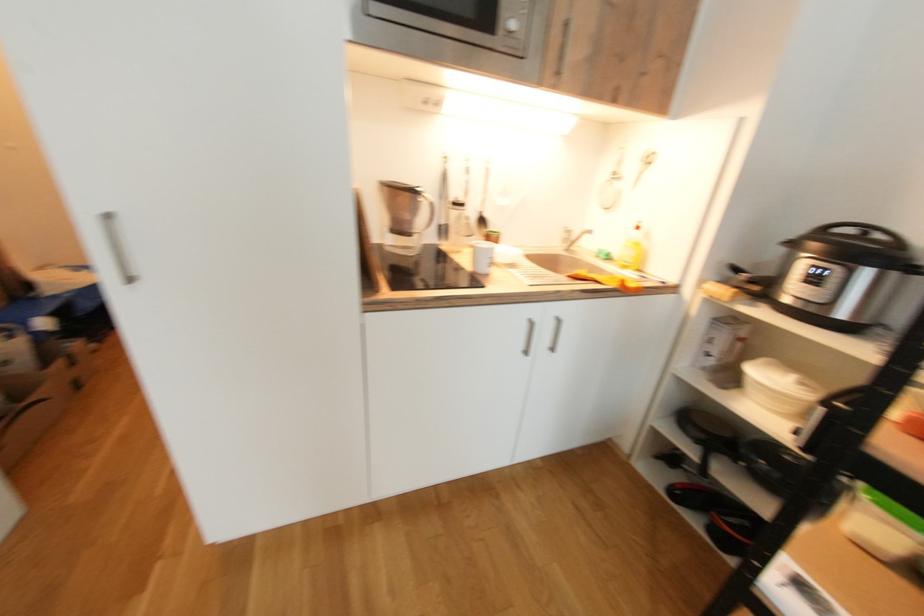
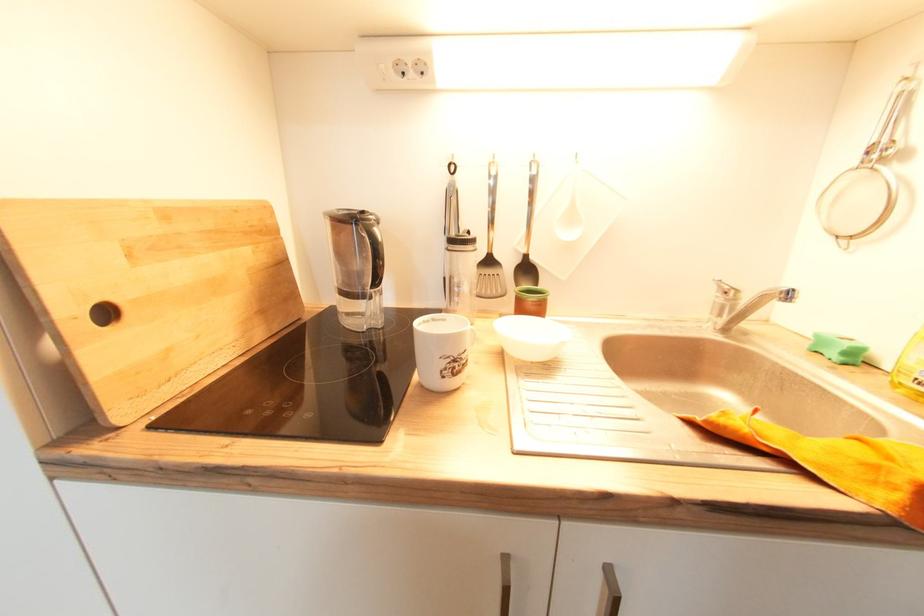
Question: The first image is from the beginning of the video and the second image is from the end. How did the camera likely rotate when shooting the video?

Choices:
 (A) Left
 (B) Right
 (C) Up
 (D) Down

Answer: (A)